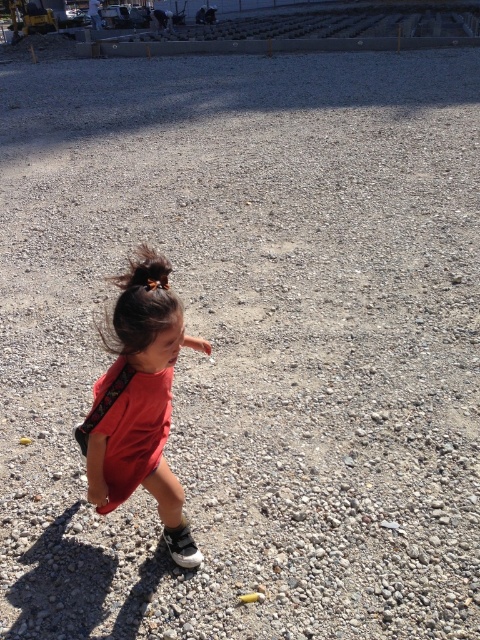
Does point (195, 339) come farther from viewer compared to point (129, 429)?

Yes.

Between point (166, 330) and point (168, 428), which one is positioned in front?

Point (166, 330) is in front.

Image resolution: width=480 pixels, height=640 pixels. Find the location of `matte red dress at center`. matte red dress at center is located at coordinates (140, 403).

Between matte red dress at center and brown shiny hair at upper left, which one appears on the left side from the viewer's perspective?

Positioned to the left is brown shiny hair at upper left.

Is matte red dress at center smaller than brown shiny hair at upper left?

No, matte red dress at center is not smaller than brown shiny hair at upper left.

Does point (128, 339) come farther from viewer compared to point (128, 333)?

Yes, point (128, 339) is behind point (128, 333).

Where is `matte red dress at center`? The width and height of the screenshot is (480, 640). matte red dress at center is located at coordinates (140, 403).

You are a GUI agent. You are given a task and a screenshot of the screen. Output one action in this format:
    pyautogui.click(x=<x>, y=<y>)
    Task: Click on the red cotton dress at center
    This screenshot has width=480, height=640.
    Given the screenshot: What is the action you would take?
    pyautogui.click(x=129, y=426)

Is red cotton dress at center thinner than brown shiny hair at upper left?

In fact, red cotton dress at center might be wider than brown shiny hair at upper left.

Does point (117, 381) lie in front of point (162, 301)?

No, it is not.

Where is `red cotton dress at center`? The image size is (480, 640). red cotton dress at center is located at coordinates (129, 426).